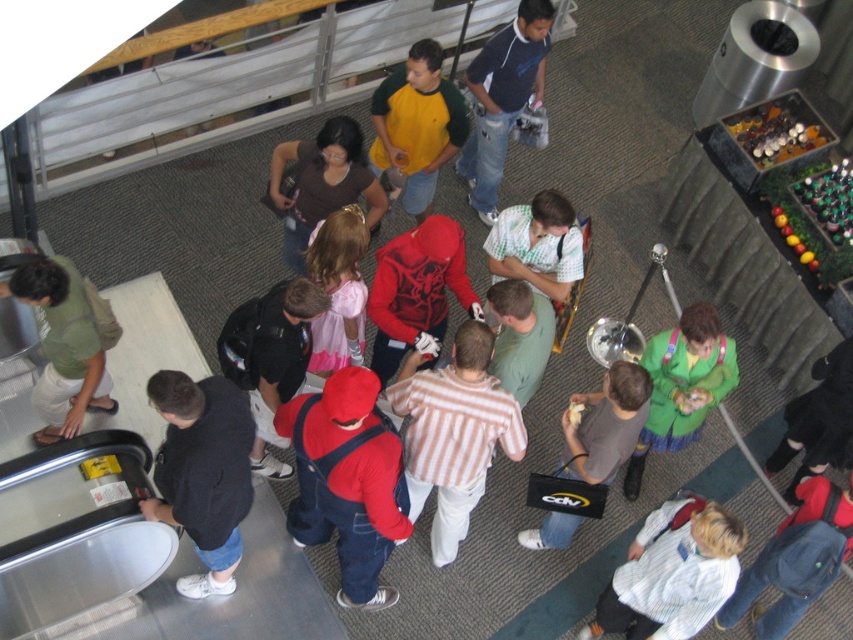
Which is above, green cotton shirt at left or yellow-green jersey at center?

yellow-green jersey at center

Measure the distance between point (x=39, y=388) and camera.

Point (x=39, y=388) is 16.74 feet away from camera.

Who is more distant from viewer, (67, 280) or (410, 120)?

The point (410, 120) is more distant.

The width and height of the screenshot is (853, 640). Identify the location of green cotton shirt at left. (67, 342).

Can you confirm if yellow-green jersey at center is shorter than pink satin dress at center?

Yes.

Is the position of yellow-green jersey at center less distant than that of pink satin dress at center?

That is False.

Identify the location of yellow-green jersey at center. (416, 124).

Locate an element on the screen. yellow-green jersey at center is located at coordinates (416, 124).

Between point (709, 547) and point (418, 88), which one is positioned in front?

Positioned in front is point (709, 547).

Which of these two, light blue sweater at center or yellow-green jersey at center, stands shorter?

light blue sweater at center

Who is more forward, (672,605) or (392,122)?

Point (672,605) is in front.

At what (x,y) coordinates should I click in order to perform the action: click on light blue sweater at center. Please return your answer as a coordinate pair (x, y). Looking at the image, I should click on (672, 573).